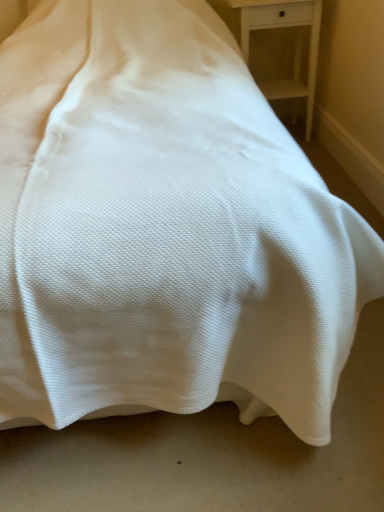
Question: Should I look upward or downward to see white wood nightstand at upper right?

Choices:
 (A) up
 (B) down

Answer: (A)